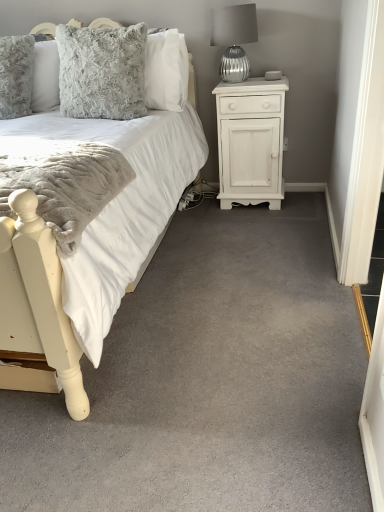
This screenshot has height=512, width=384. Describe the element at coordinates (36, 309) in the screenshot. I see `white soft fabric bed at left` at that location.

Describe the element at coordinates (102, 72) in the screenshot. I see `fluffy gray pillow at upper left` at that location.

The image size is (384, 512). What do you see at coordinates (234, 39) in the screenshot? I see `silver textured glass at upper right` at bounding box center [234, 39].

This screenshot has width=384, height=512. In order to click on white painted wood nightstand at right in this screenshot , I will do `click(251, 141)`.

Is point (114, 97) behind point (214, 329)?

That is True.

Is fluffy gray pillow at upper left in front of or behind white soft carpet at center in the image?

fluffy gray pillow at upper left is behind white soft carpet at center.

Between fluffy gray pillow at upper left and white soft carpet at center, which one has smaller size?

Smaller between the two is fluffy gray pillow at upper left.

Is fluffy gray pillow at upper left looking in the opposite direction of white soft carpet at center?

No, fluffy gray pillow at upper left is not facing away from white soft carpet at center.

Based on the photo, is silver textured glass at upper right bigger than fluffy gray pillow at upper left?

Actually, silver textured glass at upper right might be smaller than fluffy gray pillow at upper left.

From the image's perspective, which is below, silver textured glass at upper right or fluffy gray pillow at upper left?

fluffy gray pillow at upper left.

Considering the points (231, 49) and (112, 111), which point is behind, point (231, 49) or point (112, 111)?

The point (231, 49) is more distant.

Is silver textured glass at upper right positioned with its back to fluffy gray pillow at upper left?

No, silver textured glass at upper right is not facing the opposite direction of fluffy gray pillow at upper left.

Which object is positioned more to the left, white soft fabric bed at left or white soft carpet at center?

Positioned to the left is white soft fabric bed at left.

Do you think white soft fabric bed at left is within white soft carpet at center, or outside of it?

white soft fabric bed at left is located beyond the bounds of white soft carpet at center.

Considering the sizes of objects white painted wood nightstand at right and silver textured glass at upper right in the image provided, who is wider, white painted wood nightstand at right or silver textured glass at upper right?

With larger width is white painted wood nightstand at right.

Is white painted wood nightstand at right outside of silver textured glass at upper right?

Yes.

Is white painted wood nightstand at right aimed at silver textured glass at upper right?

No.

From the picture: From a real-world perspective, is white painted wood nightstand at right under silver textured glass at upper right?

Yes.

Is white soft carpet at center located outside white painted wood nightstand at right?

Absolutely, white soft carpet at center is external to white painted wood nightstand at right.

From the image's perspective, does white soft carpet at center appear higher than white painted wood nightstand at right?

Incorrect, from the image's perspective, white soft carpet at center is lower than white painted wood nightstand at right.

Which of these two, white soft carpet at center or white painted wood nightstand at right, stands shorter?

With less height is white soft carpet at center.

Is white soft carpet at center in front of white painted wood nightstand at right?

Yes, the depth of white soft carpet at center is less than that of white painted wood nightstand at right.

Looking at this image, which is closer to the camera, (60,300) or (232,50)?

Point (60,300)

Can you see white soft fabric bed at left touching silver textured glass at upper right?

No.

From the image's perspective, would you say white soft fabric bed at left is positioned over silver textured glass at upper right?

No, from the image's perspective, white soft fabric bed at left is not above silver textured glass at upper right.

How many degrees apart are the facing directions of white soft fabric bed at left and silver textured glass at upper right?

2.38 degrees.

At what (x,y) coordinates should I click in order to perform the action: click on bed above the white painted wood nightstand at right (from a real-world perspective). Please return your answer as a coordinate pair (x, y). This screenshot has height=512, width=384. Looking at the image, I should click on (36, 309).

Are white soft fabric bed at left and white painted wood nightstand at right making contact?

No.

Is white soft fabric bed at left situated inside white painted wood nightstand at right or outside?

white soft fabric bed at left cannot be found inside white painted wood nightstand at right.

Visually, is white soft fabric bed at left positioned to the left or to the right of white painted wood nightstand at right?

From the image, it's evident that white soft fabric bed at left is to the left of white painted wood nightstand at right.

You are a GUI agent. You are given a task and a screenshot of the screen. Output one action in this format:
    pyautogui.click(x=<x>, y=<y>)
    Task: Click on the plain in front of the fluffy gray pillow at upper left
    
    Given the screenshot: What is the action you would take?
    pyautogui.click(x=210, y=381)

Where is `table lamp lying behind the fluffy gray pillow at upper left`? table lamp lying behind the fluffy gray pillow at upper left is located at coordinates (234, 39).

Which object lies nearer to the anchor point white soft carpet at center, white soft fabric bed at left or fluffy gray pillow at upper left?

white soft fabric bed at left is closer to white soft carpet at center.

Considering their positions, is white soft fabric bed at left positioned further to white painted wood nightstand at right than fluffy gray pillow at upper left?

Among the two, white soft fabric bed at left is located further to white painted wood nightstand at right.

Considering their positions, is fluffy gray pillow at upper left positioned further to silver textured glass at upper right than white painted wood nightstand at right?

fluffy gray pillow at upper left.

Considering their positions, is white soft carpet at center positioned further to silver textured glass at upper right than white painted wood nightstand at right?

The object further to silver textured glass at upper right is white soft carpet at center.

Looking at the image, which one is located further to silver textured glass at upper right, white painted wood nightstand at right or white soft fabric bed at left?

white soft fabric bed at left.

Based on their spatial positions, is white soft fabric bed at left or white soft carpet at center further from silver textured glass at upper right?

white soft fabric bed at left.

Consider the image. From the image, which object appears to be farther from fluffy gray pillow at upper left, white painted wood nightstand at right or silver textured glass at upper right?

The object further to fluffy gray pillow at upper left is white painted wood nightstand at right.

From the image, which object appears to be nearer to white soft fabric bed at left, white soft carpet at center or white painted wood nightstand at right?

The object closer to white soft fabric bed at left is white soft carpet at center.

Identify the location of table lamp between white soft fabric bed at left and white painted wood nightstand at right along the z-axis. This screenshot has width=384, height=512. (234, 39).

Find the location of a particular element. pillow between white soft carpet at center and silver textured glass at upper right along the z-axis is located at coordinates (102, 72).

The height and width of the screenshot is (512, 384). In order to click on plain between white soft fabric bed at left and fluffy gray pillow at upper left from front to back in this screenshot , I will do `click(210, 381)`.

Where is `table lamp between fluffy gray pillow at upper left and white painted wood nightstand at right from left to right`? This screenshot has width=384, height=512. table lamp between fluffy gray pillow at upper left and white painted wood nightstand at right from left to right is located at coordinates (234, 39).